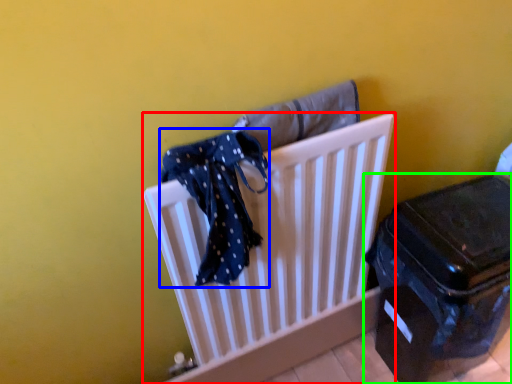
Question: Considering the real-world distances, which object is farthest from furniture (highlighted by a red box)? scarf (highlighted by a blue box) or suitcase (highlighted by a green box)?

Choices:
 (A) scarf
 (B) suitcase

Answer: (B)